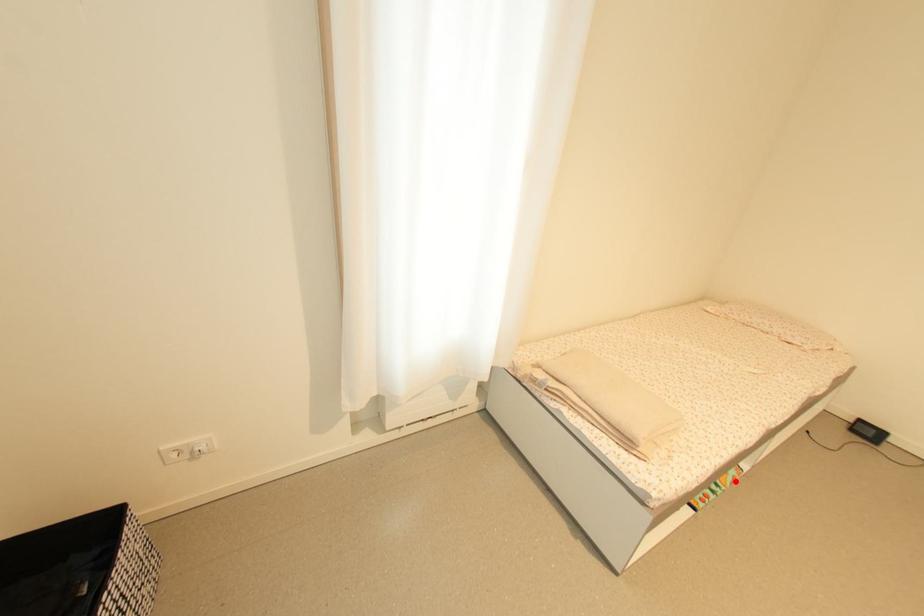
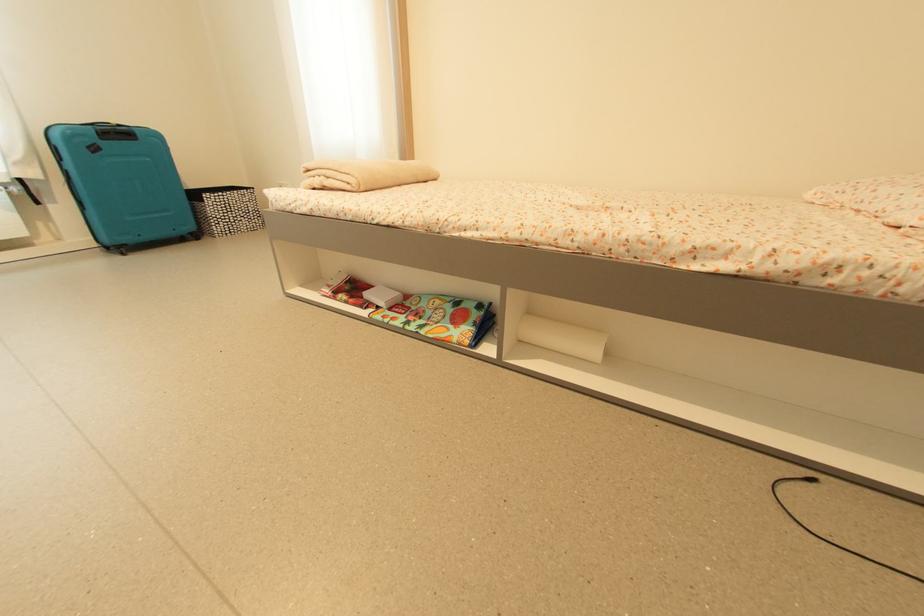
Find the pixel in the second image that matches the highlighted location in the first image.

(447, 337)